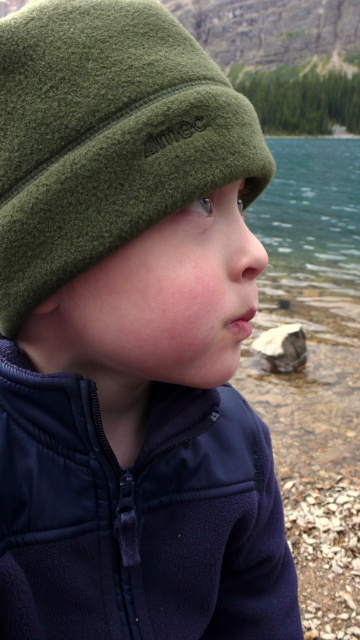
Does navy fleece jacket at lower right have a smaller size compared to olive green fleece beanie at upper left?

Actually, navy fleece jacket at lower right might be larger than olive green fleece beanie at upper left.

Between navy fleece jacket at lower right and olive green fleece beanie at upper left, which one has more height?

With more height is navy fleece jacket at lower right.

Between point (276, 637) and point (140, 81), which one is positioned in front?

Point (140, 81) is in front.

Find the location of a particular element. The height and width of the screenshot is (640, 360). navy fleece jacket at lower right is located at coordinates tap(137, 516).

Between navy fleece jacket at lower right and greenish-blue water at center, which one is positioned lower?

navy fleece jacket at lower right is lower down.

Looking at this image, who is higher up, navy fleece jacket at lower right or greenish-blue water at center?

Positioned higher is greenish-blue water at center.

Locate an element on the screen. navy fleece jacket at lower right is located at coordinates (137, 516).

The width and height of the screenshot is (360, 640). What are the coordinates of `navy fleece jacket at lower right` in the screenshot? It's located at (137, 516).

Who is more forward, (x=100, y=513) or (x=263, y=352)?

Point (x=100, y=513)

Can you confirm if navy fleece jacket at lower right is positioned below gray rough stone at lower center?

Incorrect, navy fleece jacket at lower right is not positioned below gray rough stone at lower center.

At what (x,y) coordinates should I click in order to perform the action: click on navy fleece jacket at lower right. Please return your answer as a coordinate pair (x, y). This screenshot has width=360, height=640. Looking at the image, I should click on (137, 516).